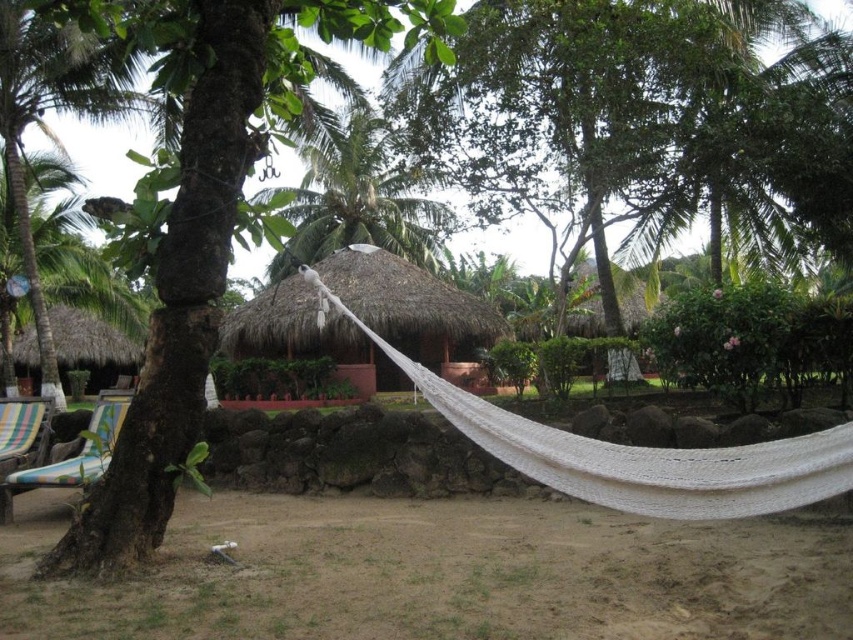
You are standing in the tropical garden and want to place a small decorative statue between the two points labeled point (x=355, y=154) and point (x=4, y=506). Which point should the statue be closer to if you want it to be more visible to visitors approaching from the front?

The statue should be placed closer to point (x=355, y=154) because it is further to the camera than point (x=4, y=506), making it more visible to visitors approaching from the front.

You are standing at the center of the image and want to walk towards the thatched straw hut at center. Which direction should you move to reach it?

The thatched straw hut at center is already at the center of the image, so you are already facing it. You don not need to move in any direction to reach it.